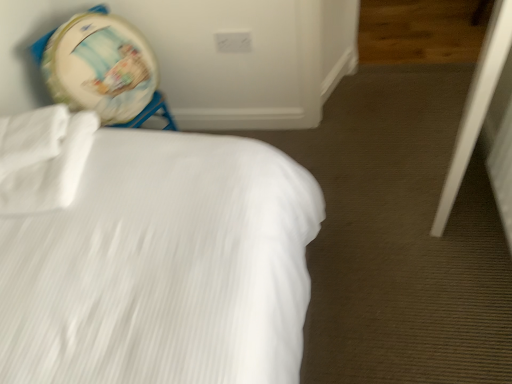
Question: From a real-world perspective, is white matte sheet at upper left physically below white plastic screen door at lower right?

Choices:
 (A) yes
 (B) no

Answer: (B)

Question: Is white plastic screen door at lower right at the back of white matte sheet at upper left?

Choices:
 (A) no
 (B) yes

Answer: (A)

Question: Can you confirm if white matte sheet at upper left is wider than white plastic screen door at lower right?

Choices:
 (A) no
 (B) yes

Answer: (B)

Question: Are white matte sheet at upper left and white plastic screen door at lower right beside each other?

Choices:
 (A) no
 (B) yes

Answer: (A)

Question: Is white plastic screen door at lower right located within white matte sheet at upper left?

Choices:
 (A) yes
 (B) no

Answer: (B)

Question: Which is correct: wooden textured drum at upper left is inside white textured bed at upper left, or outside of it?

Choices:
 (A) inside
 (B) outside

Answer: (B)

Question: Is point (111, 64) positioned closer to the camera than point (76, 125)?

Choices:
 (A) closer
 (B) farther

Answer: (B)

Question: Is wooden textured drum at upper left wider or thinner than white textured bed at upper left?

Choices:
 (A) wide
 (B) thin

Answer: (B)

Question: Is wooden textured drum at upper left in front of or behind white textured bed at upper left in the image?

Choices:
 (A) front
 (B) behind

Answer: (B)

Question: Looking at the image, does white matte sheet at upper left seem bigger or smaller compared to white textured bed at upper left?

Choices:
 (A) small
 (B) big

Answer: (A)

Question: In terms of width, does white matte sheet at upper left look wider or thinner when compared to white textured bed at upper left?

Choices:
 (A) thin
 (B) wide

Answer: (A)

Question: Considering the relative positions of white matte sheet at upper left and white textured bed at upper left in the image provided, is white matte sheet at upper left to the left or to the right of white textured bed at upper left?

Choices:
 (A) left
 (B) right

Answer: (A)

Question: Is white matte sheet at upper left taller or shorter than white textured bed at upper left?

Choices:
 (A) tall
 (B) short

Answer: (B)

Question: Is white matte sheet at upper left inside the boundaries of white plastic screen door at lower right, or outside?

Choices:
 (A) outside
 (B) inside

Answer: (A)

Question: Considering the positions of white matte sheet at upper left and white plastic screen door at lower right in the image, is white matte sheet at upper left wider or thinner than white plastic screen door at lower right?

Choices:
 (A) thin
 (B) wide

Answer: (B)